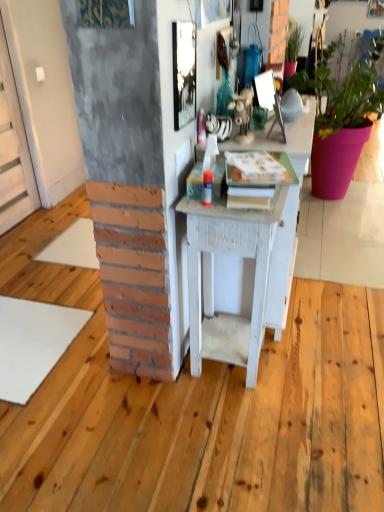
Question: Is metallic reflective mirror at upper center, marked as the second picture frame in a front-to-back arrangement, smaller than green matte plant at upper right, which appears as the 1th houseplant when viewed from the left?

Choices:
 (A) yes
 (B) no

Answer: (A)

Question: Is metallic reflective mirror at upper center, which is the 2th picture frame in left-to-right order, to the left of green matte plant at upper right, the 2th houseplant positioned from the right, from the viewer's perspective?

Choices:
 (A) no
 (B) yes

Answer: (B)

Question: Is metallic reflective mirror at upper center, positioned as the 1th picture frame in back-to-front order, further to the viewer compared to green matte plant at upper right, the 2th houseplant positioned from the right?

Choices:
 (A) yes
 (B) no

Answer: (B)

Question: Is metallic reflective mirror at upper center, which is the first picture frame from right to left, at the right side of green matte plant at upper right, the 2th houseplant positioned from the right?

Choices:
 (A) no
 (B) yes

Answer: (A)

Question: Is green matte plant at upper right, which appears as the 1th houseplant when viewed from the left, located within metallic reflective mirror at upper center, which is the first picture frame from right to left?

Choices:
 (A) yes
 (B) no

Answer: (B)

Question: Looking at the image, does green matte plant at upper right, the 2th houseplant positioned from the right, seem bigger or smaller compared to metallic textured picture frame at upper center, the 2th picture frame positioned from the right?

Choices:
 (A) small
 (B) big

Answer: (B)

Question: Is green matte plant at upper right, which appears as the 1th houseplant when viewed from the left, situated inside metallic textured picture frame at upper center, positioned as the first picture frame in left-to-right order, or outside?

Choices:
 (A) outside
 (B) inside

Answer: (A)

Question: From their relative heights in the image, would you say green matte plant at upper right, the 2th houseplant positioned from the right, is taller or shorter than metallic textured picture frame at upper center, arranged as the 1th picture frame when viewed from the front?

Choices:
 (A) tall
 (B) short

Answer: (B)

Question: Is point (296, 40) closer or farther from the camera than point (130, 22)?

Choices:
 (A) farther
 (B) closer

Answer: (A)

Question: Is metallic textured picture frame at upper center, which is counted as the 2th picture frame, starting from the back, bigger or smaller than green matte plant at upper right, which appears as the 1th houseplant when viewed from the left?

Choices:
 (A) big
 (B) small

Answer: (B)

Question: From a real-world perspective, is metallic textured picture frame at upper center, positioned as the first picture frame in left-to-right order, positioned above or below green matte plant at upper right, which appears as the 1th houseplant when viewed from the left?

Choices:
 (A) above
 (B) below

Answer: (A)

Question: Considering the relative positions of metallic textured picture frame at upper center, arranged as the 1th picture frame when viewed from the front, and green matte plant at upper right, which appears as the 1th houseplant when viewed from the left, in the image provided, is metallic textured picture frame at upper center, arranged as the 1th picture frame when viewed from the front, to the left or to the right of green matte plant at upper right, which appears as the 1th houseplant when viewed from the left,?

Choices:
 (A) right
 (B) left

Answer: (B)

Question: From the image's perspective, is metallic textured picture frame at upper center, arranged as the 1th picture frame when viewed from the front, above or below green matte plant at upper right, the 2th houseplant positioned from the right?

Choices:
 (A) below
 (B) above

Answer: (A)

Question: Is matte pink pot at right, positioned as the 2th houseplant in left-to-right order, in front of or behind green matte plant at upper right, which appears as the 1th houseplant when viewed from the left, in the image?

Choices:
 (A) behind
 (B) front

Answer: (B)

Question: In terms of width, does matte pink pot at right, positioned as the 2th houseplant in left-to-right order, look wider or thinner when compared to green matte plant at upper right, the 2th houseplant positioned from the right?

Choices:
 (A) wide
 (B) thin

Answer: (A)